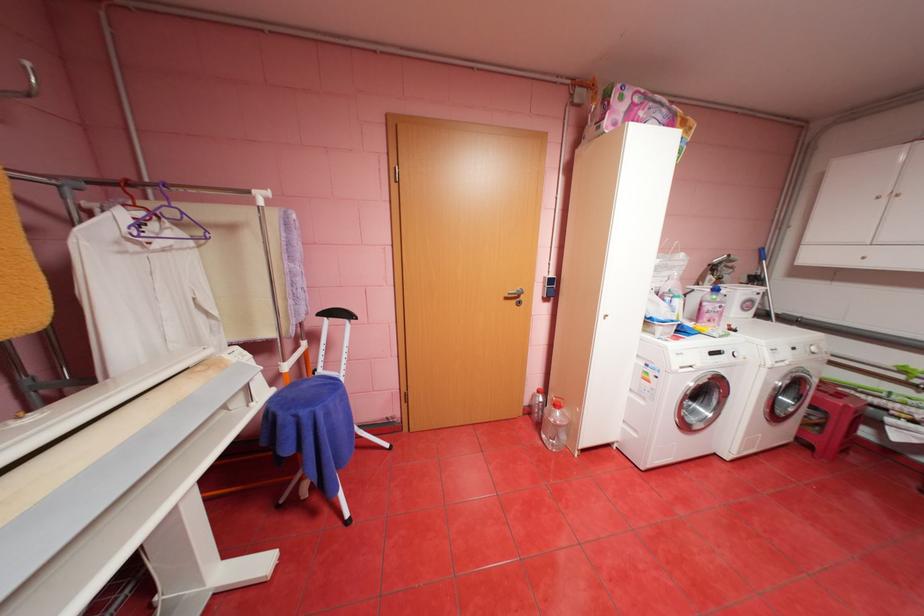
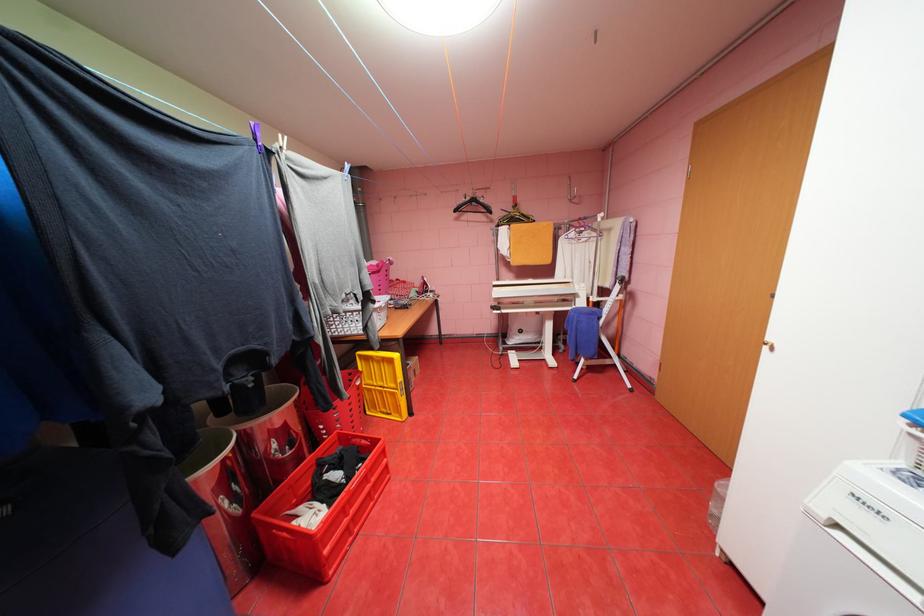
Find the pixel in the second image that matches (x=142, y=177) in the first image.

(591, 216)